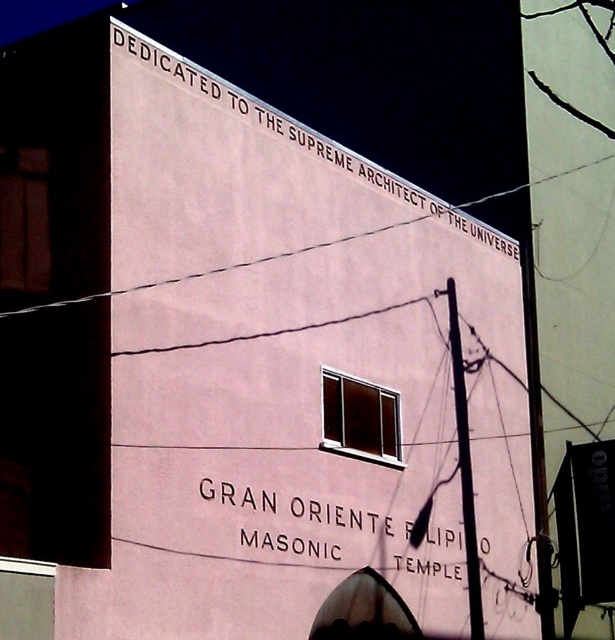
Question: Is black text at upper center to the right of white painted text at center from the viewer's perspective?

Choices:
 (A) no
 (B) yes

Answer: (B)

Question: Is black text at upper center above white painted text at center?

Choices:
 (A) yes
 (B) no

Answer: (A)

Question: Which of the following is the closest to the observer?

Choices:
 (A) (470, 477)
 (B) (175, 70)

Answer: (B)

Question: Can you confirm if black text at upper center is bigger than white painted text at center?

Choices:
 (A) yes
 (B) no

Answer: (A)